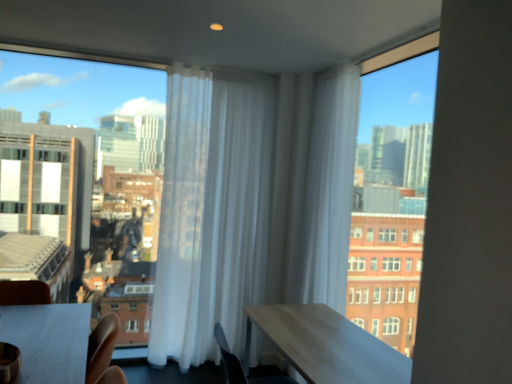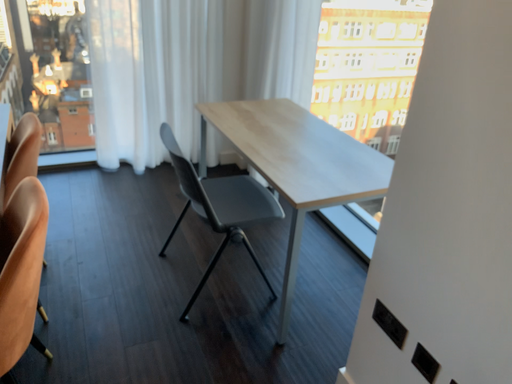
Question: Which way did the camera rotate in the video?

Choices:
 (A) rotated upward
 (B) rotated downward

Answer: (B)